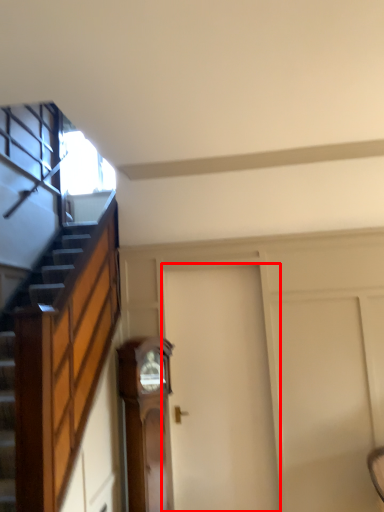
Question: Where is door (annotated by the red box) located in relation to furniture in the image?

Choices:
 (A) right
 (B) left

Answer: (A)